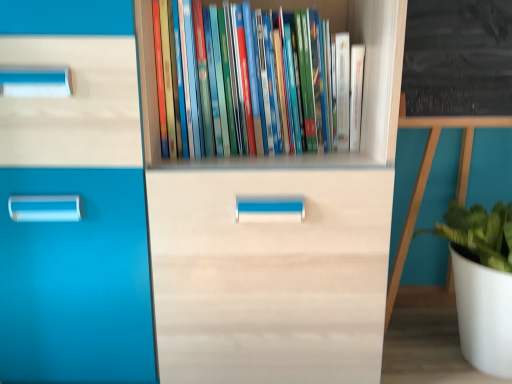
Question: Is hardcover books at center completely or partially inside white matte pot at right?

Choices:
 (A) yes
 (B) no

Answer: (B)

Question: Is white matte pot at right far from hardcover books at center?

Choices:
 (A) yes
 (B) no

Answer: (B)

Question: Does white matte pot at right appear on the right side of hardcover books at center?

Choices:
 (A) yes
 (B) no

Answer: (A)

Question: Can we say white matte pot at right lies outside hardcover books at center?

Choices:
 (A) yes
 (B) no

Answer: (A)

Question: Is white matte pot at right bigger than hardcover books at center?

Choices:
 (A) no
 (B) yes

Answer: (B)

Question: Is white matte pot at right beside hardcover books at center?

Choices:
 (A) yes
 (B) no

Answer: (B)

Question: Are hardcover books at center and white matte pot at right far apart?

Choices:
 (A) yes
 (B) no

Answer: (B)

Question: From the image's perspective, does hardcover books at center appear lower than white matte pot at right?

Choices:
 (A) yes
 (B) no

Answer: (B)

Question: From a real-world perspective, is hardcover books at center on white matte pot at right?

Choices:
 (A) yes
 (B) no

Answer: (A)

Question: Is hardcover books at center at the right side of white matte pot at right?

Choices:
 (A) no
 (B) yes

Answer: (A)

Question: From the image's perspective, is hardcover books at center located above white matte pot at right?

Choices:
 (A) yes
 (B) no

Answer: (A)

Question: Is hardcover books at center located outside white matte pot at right?

Choices:
 (A) yes
 (B) no

Answer: (A)

Question: Is white matte pot at right inside or outside of hardcover books at center?

Choices:
 (A) inside
 (B) outside

Answer: (B)